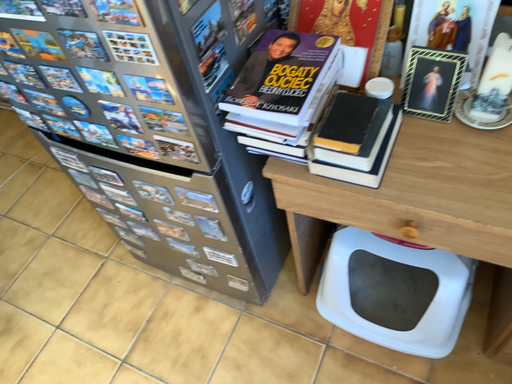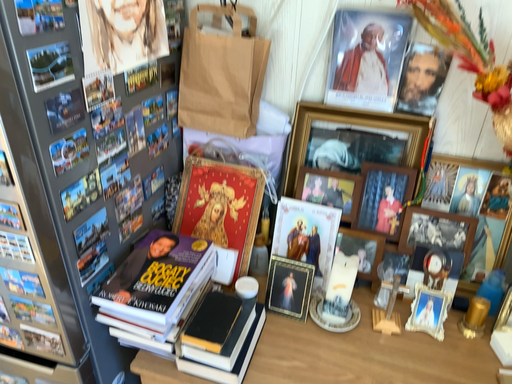
Question: Which way did the camera rotate in the video?

Choices:
 (A) rotated downward
 (B) rotated upward

Answer: (B)